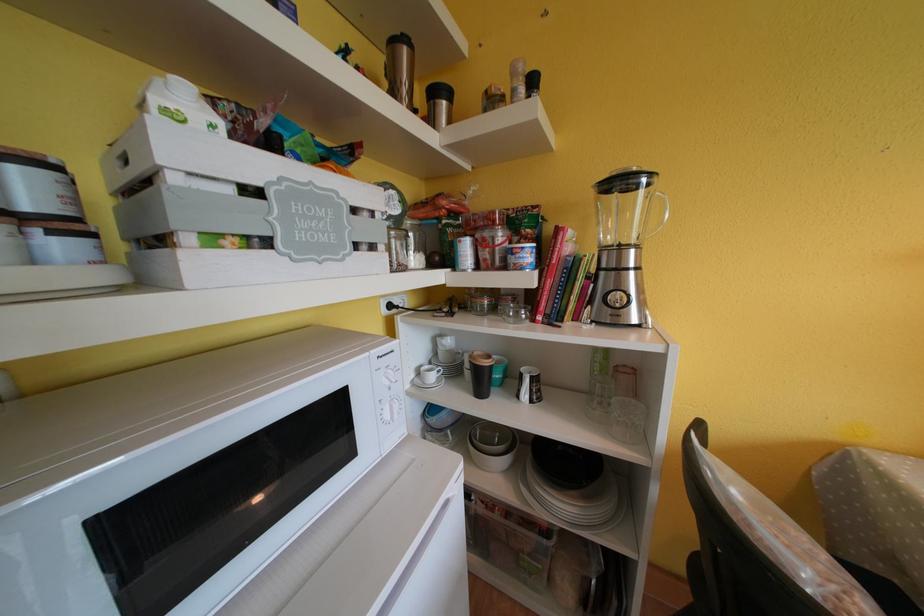
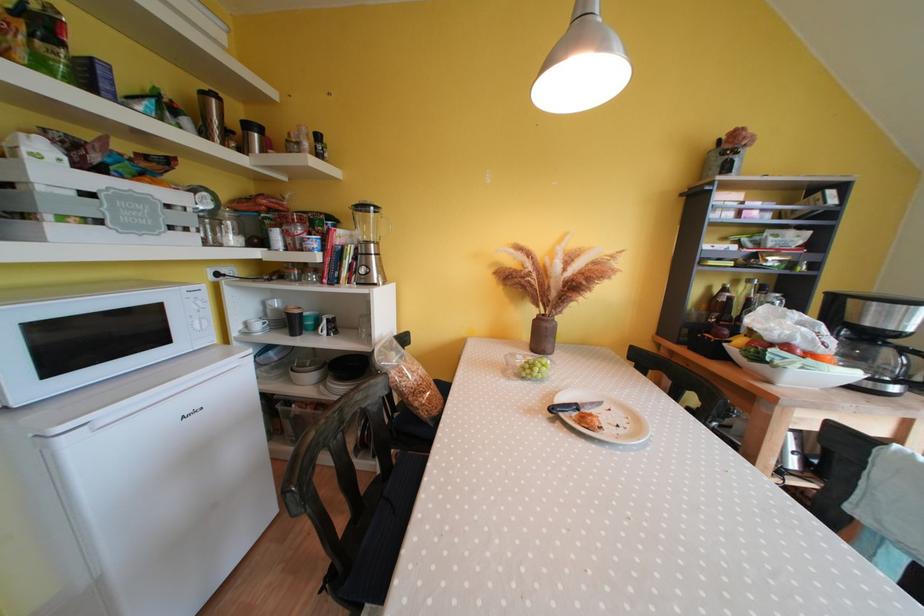
Find the pixel in the second image that matches point (638, 254) in the first image.

(379, 249)